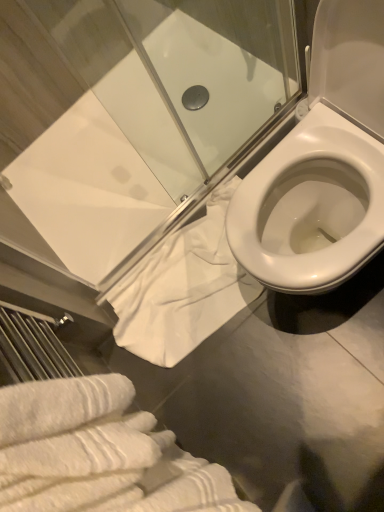
I want to click on white cotton towel at lower center, acting as the first bath towel starting from the back, so click(183, 288).

The height and width of the screenshot is (512, 384). What are the coordinates of `white textured bath towel at lower left, the first bath towel in the front-to-back sequence` in the screenshot? It's located at (98, 453).

Measure the distance between white textured bath towel at lower left, the first bath towel in the front-to-back sequence, and camera.

white textured bath towel at lower left, the first bath towel in the front-to-back sequence, is 16.42 inches from camera.

At what (x,y) coordinates should I click in order to perform the action: click on transparent glass shower door at upper center. Please return your answer as a coordinate pair (x, y). This screenshot has height=512, width=384. Looking at the image, I should click on (153, 87).

In the scene shown: From a real-world perspective, is transparent glass shower door at upper center positioned above or below white textured bath towel at lower left, the first bath towel in the front-to-back sequence?

Clearly, from a real-world perspective, transparent glass shower door at upper center is below white textured bath towel at lower left, the first bath towel in the front-to-back sequence.

Does transparent glass shower door at upper center turn towards white textured bath towel at lower left, which is counted as the second bath towel, starting from the back?

Yes, transparent glass shower door at upper center faces towards white textured bath towel at lower left, which is counted as the second bath towel, starting from the back.

Find the location of a particular element. shower door that is under the white textured bath towel at lower left, the first bath towel in the front-to-back sequence (from a real-world perspective) is located at coordinates (153, 87).

Between transparent glass shower door at upper center and white textured bath towel at lower left, the first bath towel in the front-to-back sequence, which one appears on the right side from the viewer's perspective?

Positioned to the right is transparent glass shower door at upper center.

From the picture: In terms of height, does white textured bath towel at lower left, which is counted as the second bath towel, starting from the back, look taller or shorter compared to white cotton towel at lower center, acting as the first bath towel starting from the back?

Considering their sizes, white textured bath towel at lower left, which is counted as the second bath towel, starting from the back, has more height than white cotton towel at lower center, acting as the first bath towel starting from the back.

From the image's perspective, is white textured bath towel at lower left, which is counted as the second bath towel, starting from the back, under white cotton towel at lower center, acting as the first bath towel starting from the back?

Correct, white textured bath towel at lower left, which is counted as the second bath towel, starting from the back, appears lower than white cotton towel at lower center, acting as the first bath towel starting from the back, in the image.

Is white textured bath towel at lower left, the first bath towel in the front-to-back sequence, spatially inside white cotton towel at lower center, which is the 2th bath towel from front to back, or outside of it?

white textured bath towel at lower left, the first bath towel in the front-to-back sequence, is spatially situated outside white cotton towel at lower center, which is the 2th bath towel from front to back.

Is transparent glass shower door at upper center located outside white cotton towel at lower center, which is the 2th bath towel from front to back?

Yes, transparent glass shower door at upper center is outside of white cotton towel at lower center, which is the 2th bath towel from front to back.

From a real-world perspective, is transparent glass shower door at upper center positioned over white cotton towel at lower center, acting as the first bath towel starting from the back, based on gravity?

Yes, from a real-world perspective, transparent glass shower door at upper center is on top of white cotton towel at lower center, acting as the first bath towel starting from the back.

What's the angular difference between transparent glass shower door at upper center and white cotton towel at lower center, which is the 2th bath towel from front to back,'s facing directions?

The angle between the facing direction of transparent glass shower door at upper center and the facing direction of white cotton towel at lower center, which is the 2th bath towel from front to back, is 5.16 degrees.

From the image's perspective, is transparent glass shower door at upper center located above or below white cotton towel at lower center, which is the 2th bath towel from front to back?

Based on their image positions, transparent glass shower door at upper center is located above white cotton towel at lower center, which is the 2th bath towel from front to back.

Is white textured bath towel at lower left, which is counted as the second bath towel, starting from the back, not inside transparent glass shower door at upper center?

Yes, white textured bath towel at lower left, which is counted as the second bath towel, starting from the back, is located beyond the bounds of transparent glass shower door at upper center.

Considering the relative sizes of white textured bath towel at lower left, which is counted as the second bath towel, starting from the back, and transparent glass shower door at upper center in the image provided, is white textured bath towel at lower left, which is counted as the second bath towel, starting from the back, smaller than transparent glass shower door at upper center?

Correct, white textured bath towel at lower left, which is counted as the second bath towel, starting from the back, occupies less space than transparent glass shower door at upper center.

What are the coordinates of `shower door behind the white textured bath towel at lower left, the first bath towel in the front-to-back sequence` in the screenshot? It's located at (153, 87).

Do you think white cotton towel at lower center, which is the 2th bath towel from front to back, is within transparent glass shower door at upper center, or outside of it?

→ white cotton towel at lower center, which is the 2th bath towel from front to back, cannot be found inside transparent glass shower door at upper center.

This screenshot has width=384, height=512. In order to click on shower door located above the white cotton towel at lower center, which is the 2th bath towel from front to back (from a real-world perspective) in this screenshot , I will do `click(153, 87)`.

Does point (172, 268) appear closer or farther from the camera than point (112, 405)?

Clearly, point (172, 268) is more distant from the camera than point (112, 405).

Could you tell me if white cotton towel at lower center, acting as the first bath towel starting from the back, is turned towards white textured bath towel at lower left, the first bath towel in the front-to-back sequence?

No, white cotton towel at lower center, acting as the first bath towel starting from the back, does not turn towards white textured bath towel at lower left, the first bath towel in the front-to-back sequence.

Is white cotton towel at lower center, acting as the first bath towel starting from the back, placed right next to white textured bath towel at lower left, the first bath towel in the front-to-back sequence?

They are not placed beside each other.

Measure the distance from white cotton towel at lower center, acting as the first bath towel starting from the back, to white textured bath towel at lower left, the first bath towel in the front-to-back sequence.

The distance of white cotton towel at lower center, acting as the first bath towel starting from the back, from white textured bath towel at lower left, the first bath towel in the front-to-back sequence, is 26.32 inches.

You are a GUI agent. You are given a task and a screenshot of the screen. Output one action in this format:
    pyautogui.click(x=<x>, y=<y>)
    Task: Click on the bath towel above the transparent glass shower door at upper center (from a real-world perspective)
    This screenshot has height=512, width=384.
    Given the screenshot: What is the action you would take?
    pyautogui.click(x=98, y=453)

The width and height of the screenshot is (384, 512). I want to click on bath towel lying behind the white textured bath towel at lower left, which is counted as the second bath towel, starting from the back, so [x=183, y=288].

Estimate the real-world distances between objects in this image. Which object is further from transparent glass shower door at upper center, white textured bath towel at lower left, which is counted as the second bath towel, starting from the back, or white cotton towel at lower center, acting as the first bath towel starting from the back?

white textured bath towel at lower left, which is counted as the second bath towel, starting from the back, is positioned further to the anchor transparent glass shower door at upper center.

Estimate the real-world distances between objects in this image. Which object is further from white textured bath towel at lower left, the first bath towel in the front-to-back sequence, transparent glass shower door at upper center or white cotton towel at lower center, which is the 2th bath towel from front to back?

transparent glass shower door at upper center.

Based on their spatial positions, is white cotton towel at lower center, acting as the first bath towel starting from the back, or transparent glass shower door at upper center closer to white textured bath towel at lower left, which is counted as the second bath towel, starting from the back?

Among the two, white cotton towel at lower center, acting as the first bath towel starting from the back, is located nearer to white textured bath towel at lower left, which is counted as the second bath towel, starting from the back.

When comparing their distances from transparent glass shower door at upper center, does white cotton towel at lower center, acting as the first bath towel starting from the back, or white textured bath towel at lower left, the first bath towel in the front-to-back sequence, seem further?

Among the two, white textured bath towel at lower left, the first bath towel in the front-to-back sequence, is located further to transparent glass shower door at upper center.

Considering their positions, is transparent glass shower door at upper center positioned closer to white cotton towel at lower center, acting as the first bath towel starting from the back, than white textured bath towel at lower left, which is counted as the second bath towel, starting from the back?

transparent glass shower door at upper center is positioned closer to the anchor white cotton towel at lower center, acting as the first bath towel starting from the back.

When comparing their distances from white cotton towel at lower center, acting as the first bath towel starting from the back, does white textured bath towel at lower left, which is counted as the second bath towel, starting from the back, or transparent glass shower door at upper center seem closer?

Based on the image, transparent glass shower door at upper center appears to be nearer to white cotton towel at lower center, acting as the first bath towel starting from the back.

The image size is (384, 512). In order to click on shower door between white textured bath towel at lower left, which is counted as the second bath towel, starting from the back, and white cotton towel at lower center, which is the 2th bath towel from front to back, from front to back in this screenshot , I will do `click(153, 87)`.